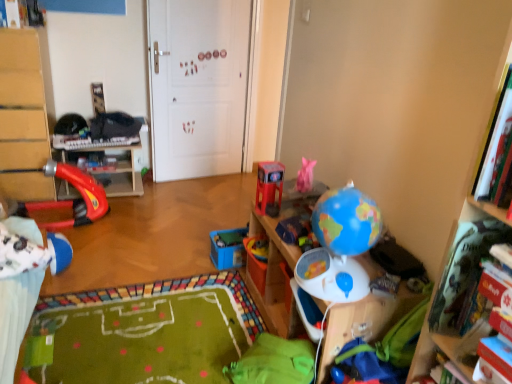
Find the location of a particular element. The image size is (512, 384). vacant space situated above blue plastic toy at center, marked as the second toy in a left-to-right arrangement (from a real-world perspective) is located at coordinates (227, 239).